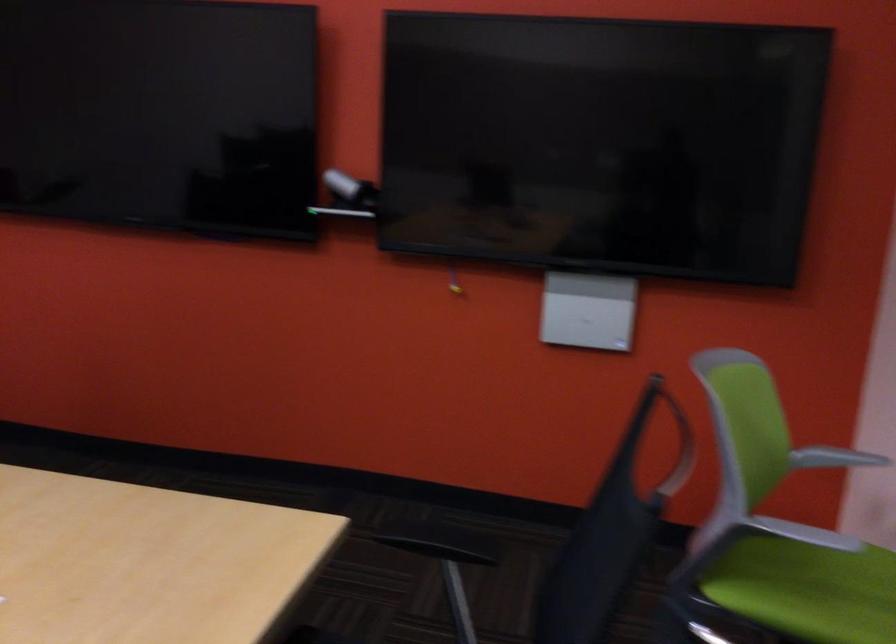
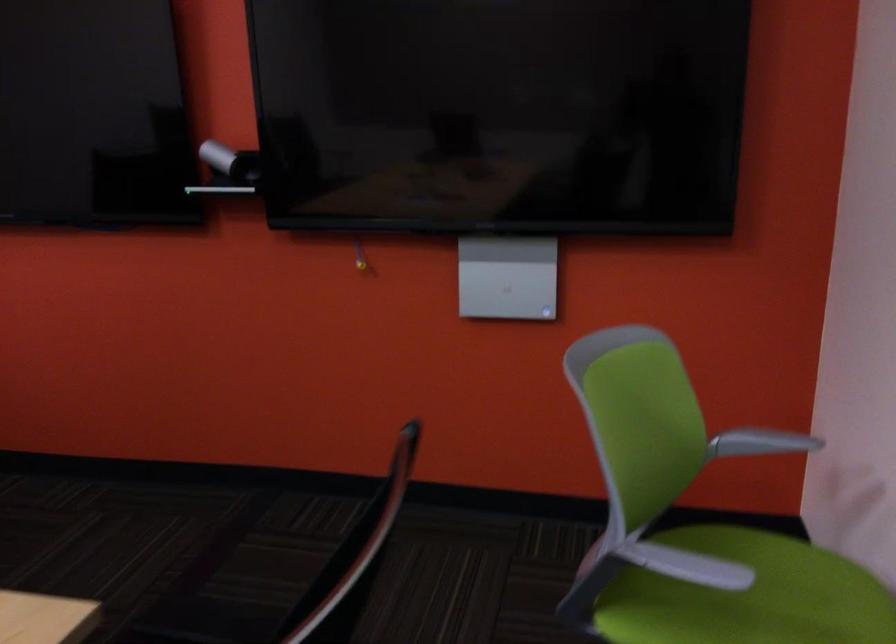
Question: How did the camera likely rotate?

Choices:
 (A) Left
 (B) Right
 (C) Up
 (D) Down

Answer: (D)